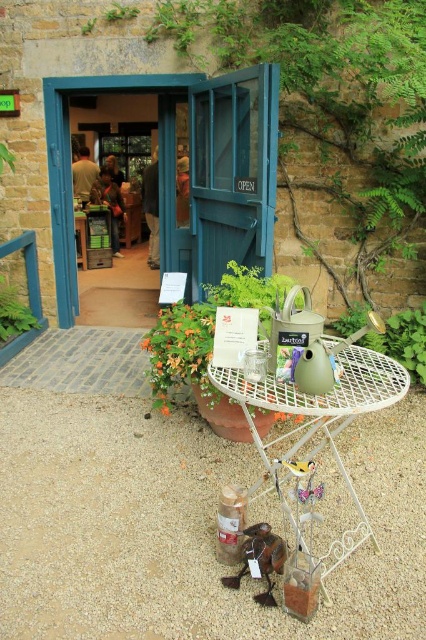
You are organizing a small garden party and need to place a decorative item on the table. The wooden bird at lower center and the green leafy plant at center are both candidates. Which item takes up more space on the table?

The green leafy plant at center is larger in size than the wooden bird at lower center, so it takes up more space on the table.